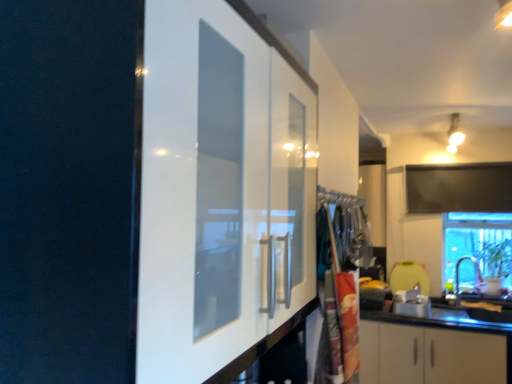
Question: Can you confirm if matte silver sink at lower right is thinner than polyester laundry bag at center?

Choices:
 (A) no
 (B) yes

Answer: (B)

Question: Could you tell me if matte silver sink at lower right is turned towards polyester laundry bag at center?

Choices:
 (A) no
 (B) yes

Answer: (B)

Question: Is matte silver sink at lower right turned away from polyester laundry bag at center?

Choices:
 (A) no
 (B) yes

Answer: (A)

Question: Would you say matte silver sink at lower right is outside polyester laundry bag at center?

Choices:
 (A) no
 (B) yes

Answer: (B)

Question: Is matte silver sink at lower right further to the viewer compared to polyester laundry bag at center?

Choices:
 (A) no
 (B) yes

Answer: (B)

Question: In terms of size, does polyester laundry bag at center appear bigger or smaller than transparent glass window at lower right?

Choices:
 (A) small
 (B) big

Answer: (A)

Question: From the image's perspective, is polyester laundry bag at center positioned above or below transparent glass window at lower right?

Choices:
 (A) above
 (B) below

Answer: (A)

Question: Which is correct: polyester laundry bag at center is inside transparent glass window at lower right, or outside of it?

Choices:
 (A) outside
 (B) inside

Answer: (A)

Question: Based on their positions, is polyester laundry bag at center located to the left or right of transparent glass window at lower right?

Choices:
 (A) left
 (B) right

Answer: (A)

Question: From a real-world perspective, relative to polyester laundry bag at center, is transparent glass window at lower right vertically above or below?

Choices:
 (A) below
 (B) above

Answer: (B)

Question: Looking at the image, does transparent glass window at lower right seem bigger or smaller compared to polyester laundry bag at center?

Choices:
 (A) big
 (B) small

Answer: (A)

Question: Looking at their shapes, would you say transparent glass window at lower right is wider or thinner than polyester laundry bag at center?

Choices:
 (A) wide
 (B) thin

Answer: (A)

Question: In the image, is transparent glass window at lower right positioned in front of or behind polyester laundry bag at center?

Choices:
 (A) front
 (B) behind

Answer: (B)

Question: In terms of height, does transparent glass window at lower right look taller or shorter compared to matte silver sink at lower right?

Choices:
 (A) short
 (B) tall

Answer: (B)

Question: Would you say transparent glass window at lower right is to the left or to the right of matte silver sink at lower right in the picture?

Choices:
 (A) right
 (B) left

Answer: (A)